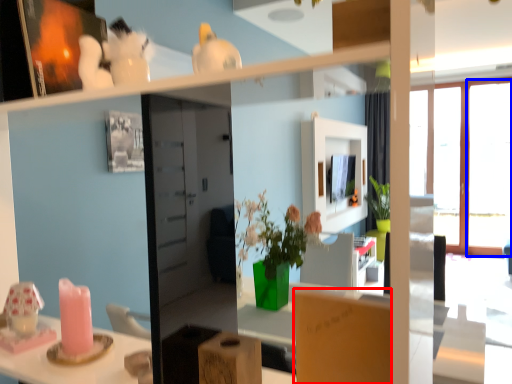
Question: Which object appears farthest to the camera in this image, cardboard box (highlighted by a red box) or window (highlighted by a blue box)?

Choices:
 (A) cardboard box
 (B) window

Answer: (B)